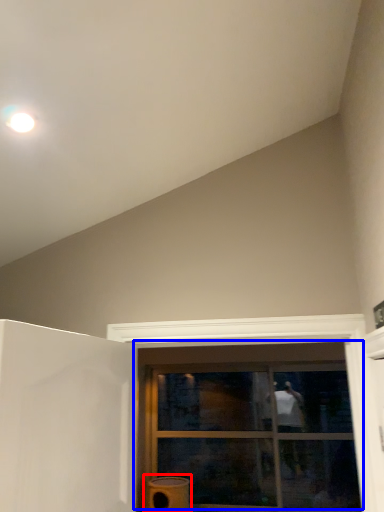
Question: Which object is further to the camera taking this photo, water heater (highlighted by a red box) or window (highlighted by a blue box)?

Choices:
 (A) water heater
 (B) window

Answer: (B)